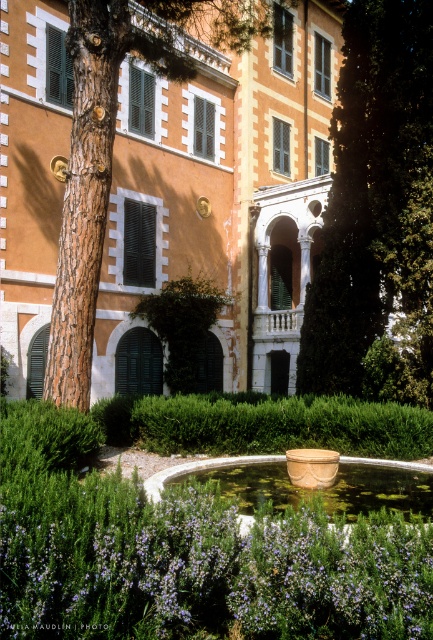
Is matte orange building at center above green leafy tree at center?

Yes.

I want to click on matte orange building at center, so click(222, 198).

Does point (93, 369) come farther from viewer compared to point (398, 132)?

That is True.

This screenshot has width=433, height=640. What are the coordinates of `matte orange building at center` in the screenshot? It's located at (222, 198).

Which of these two, green leafy hedge at center or green matte bush at center, stands shorter?

green leafy hedge at center

Is green leafy hedge at center taller than green matte bush at center?

Incorrect, green leafy hedge at center's height is not larger of green matte bush at center's.

Who is more forward, (361,412) or (186,276)?

Positioned in front is point (361,412).

Find the location of a particular element. The height and width of the screenshot is (640, 433). green leafy hedge at center is located at coordinates (280, 424).

Does point (222, 339) lie in front of point (165, 332)?

No, (222, 339) is further to viewer.

Who is taller, matte orange building at center or green matte bush at center?

matte orange building at center is taller.

Who is more distant from viewer, (235, 72) or (213, 323)?

Positioned behind is point (235, 72).

The height and width of the screenshot is (640, 433). I want to click on matte orange building at center, so click(x=222, y=198).